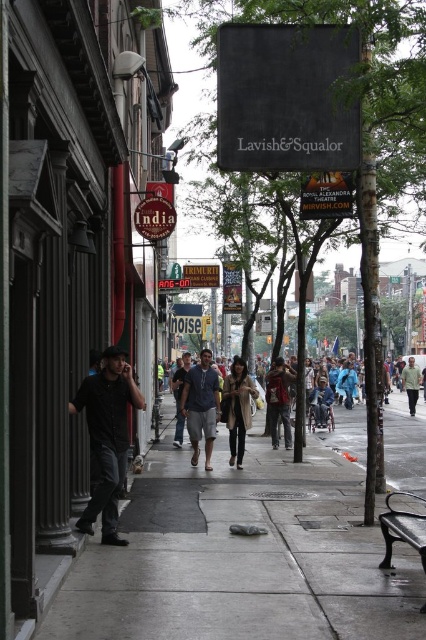
Question: Estimate the real-world distances between objects in this image. Which object is farther from the red fabric jacket at center?

Choices:
 (A) dark gray jeans at center
 (B) black fabric sign at upper center
 (C) denim shorts at center
 (D) gray concrete sidewalk at center

Answer: (B)

Question: Which of the following is the closest to the observer?

Choices:
 (A) tan leather coat at center
 (B) dark gray jeans at center
 (C) green fabric shirt at center

Answer: (A)

Question: Is black matte shirt at left to the right of tan leather coat at center from the viewer's perspective?

Choices:
 (A) no
 (B) yes

Answer: (A)

Question: Among these points, which one is farthest from the camera?

Choices:
 (A) (112, 440)
 (B) (169, 611)
 (C) (275, 444)
 (D) (180, 404)

Answer: (C)

Question: Does gray concrete sidewalk at center appear under red fabric jacket at center?

Choices:
 (A) yes
 (B) no

Answer: (A)

Question: Does gray concrete sidewalk at center appear over red fabric jacket at center?

Choices:
 (A) yes
 (B) no

Answer: (B)